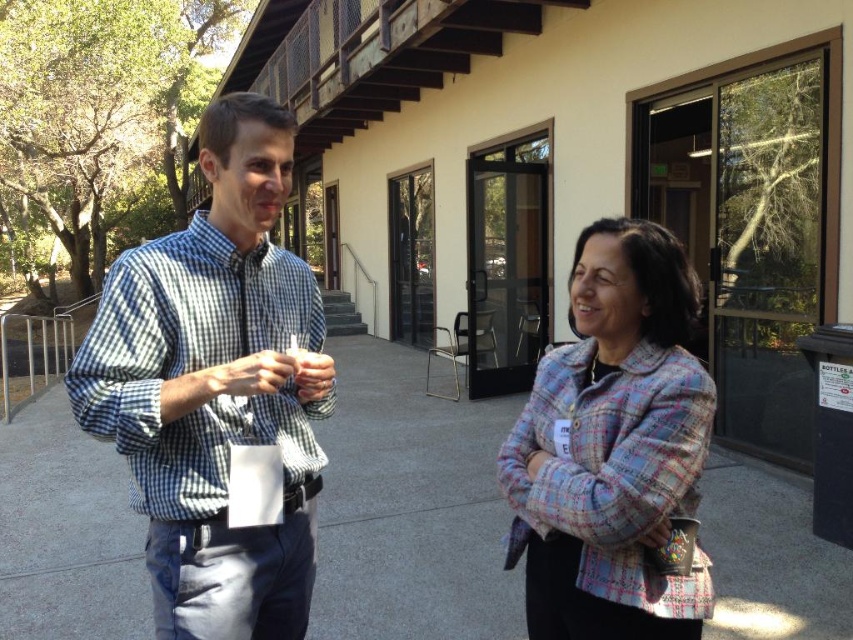
You are standing in front of the building and want to approach both the blue checkered shirt at left and the plaid fabric jacket at center. Which one should you walk towards first to reach the closer one first?

You should walk towards the blue checkered shirt at left first because it is closer to you than the plaid fabric jacket at center, so you will reach it sooner.

You are a tailor who needs to determine which garment requires more fabric for alterations. Based on the scene, which of the two items, the checkered fabric shirt at left or the plaid fabric jacket at center, would need more fabric due to its size?

The checkered fabric shirt at left requires more fabric because its width is larger than the plaid fabric jacket at center.

You are a delivery person who needs to place a small package between the checkered fabric shirt at left and the plaid fabric jacket at center. Can you fit the package in the space between them if the package is 70 centimeters long?

The checkered fabric shirt at left and plaid fabric jacket at center are 70.71 centimeters apart from each other. Since the package is 70 centimeters long, it can fit in the space between them as the distance is slightly larger than the package length.